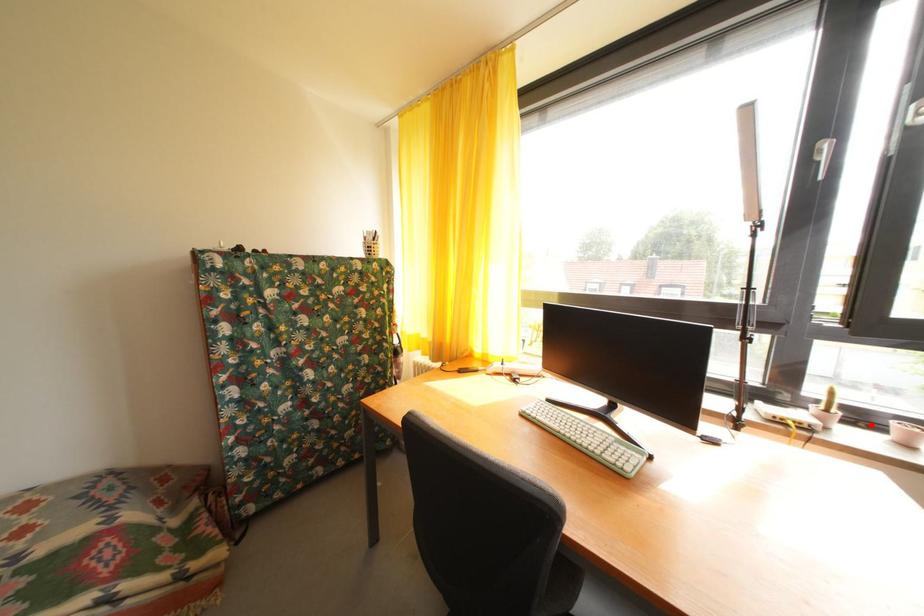
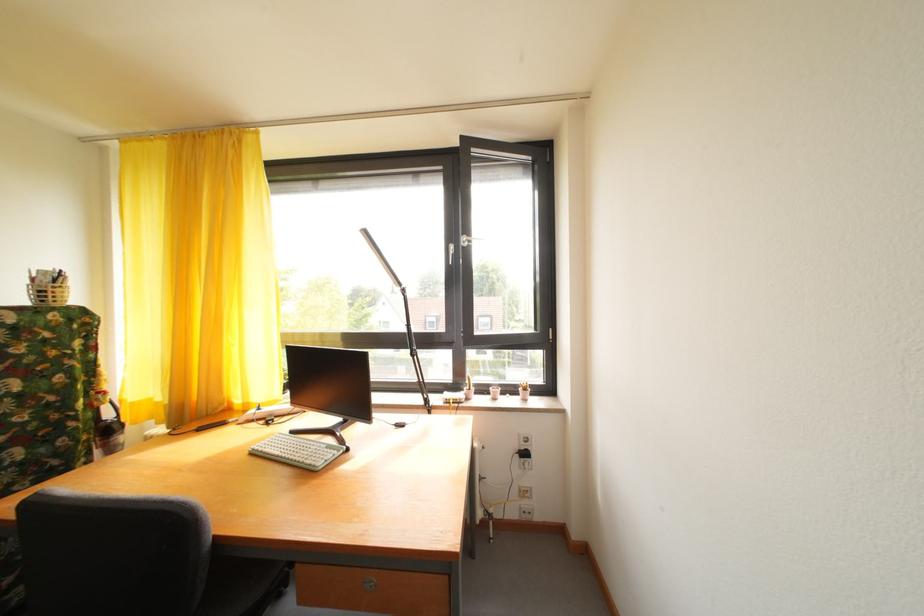
Question: I am providing you with two images of the same scene from different viewpoints. In image1, a red point is highlighted. Considering the same 3D point in image2, which of the following is correct?

Choices:
 (A) It is closer
 (B) It is farther

Answer: (B)